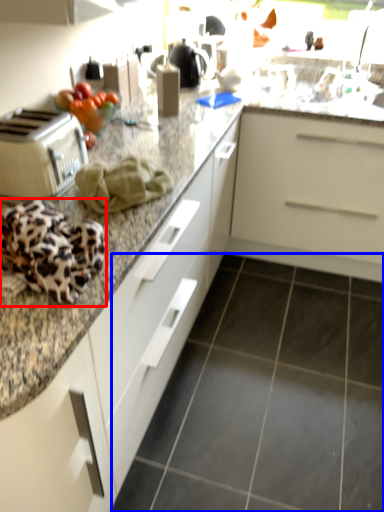
Question: Which of the following is the farthest to the observer, blanket (highlighted by a red box) or granite (highlighted by a blue box)?

Choices:
 (A) blanket
 (B) granite

Answer: (B)